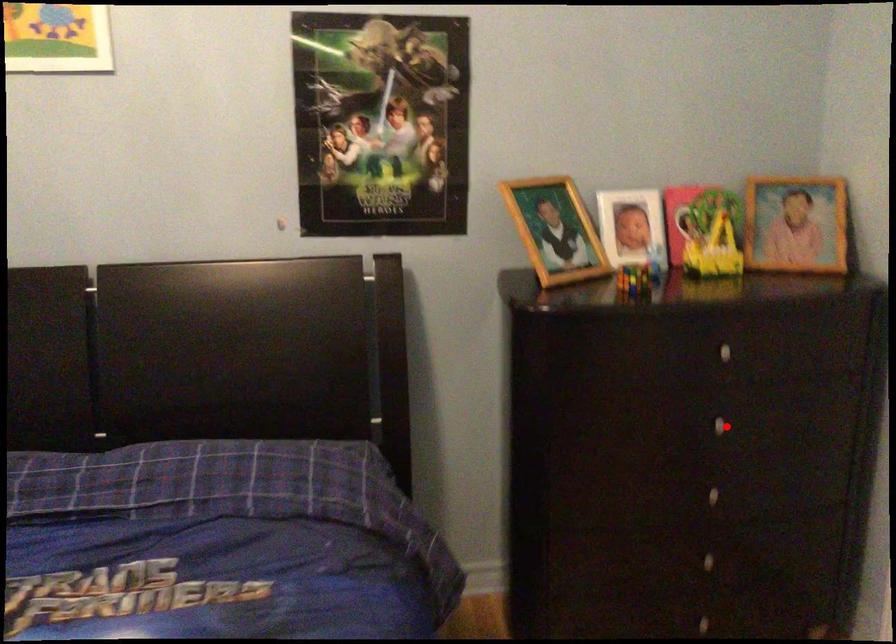
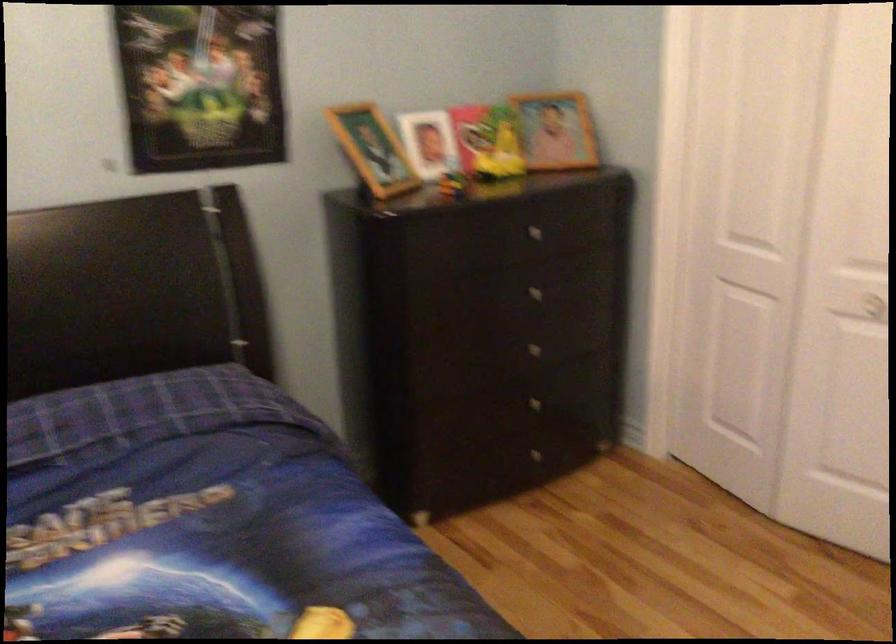
Question: I am providing you with two images of the same scene from different viewpoints. Given a red point in image1, look at the same physical point in image2. Is it:

Choices:
 (A) Closer to the viewpoint
 (B) Farther from the viewpoint

Answer: (B)